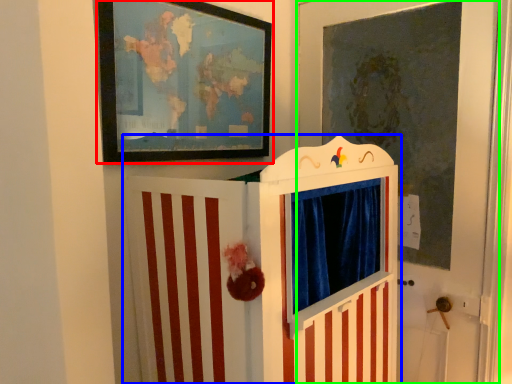
Question: Which object is the closest to the picture frame (highlighted by a red box)? Choose among these: furniture (highlighted by a blue box) or door (highlighted by a green box).

Choices:
 (A) furniture
 (B) door

Answer: (A)